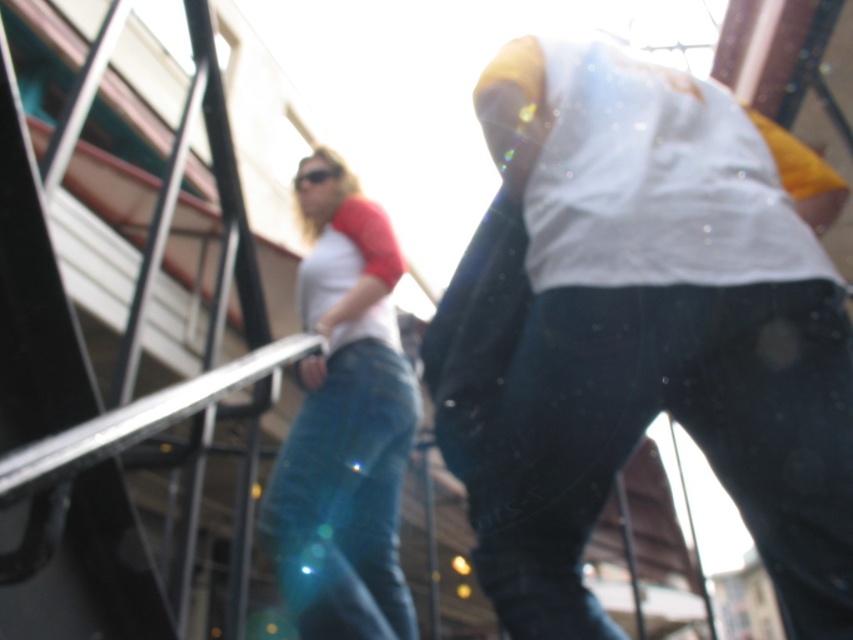
Does dark blue denim jeans at center have a greater width compared to blue denim jeans at center?

Correct, the width of dark blue denim jeans at center exceeds that of blue denim jeans at center.

Describe the element at coordinates (643, 433) in the screenshot. The height and width of the screenshot is (640, 853). I see `dark blue denim jeans at center` at that location.

Who is more distant from viewer, (x=831, y=412) or (x=345, y=600)?

Positioned behind is point (x=345, y=600).

I want to click on dark blue denim jeans at center, so click(643, 433).